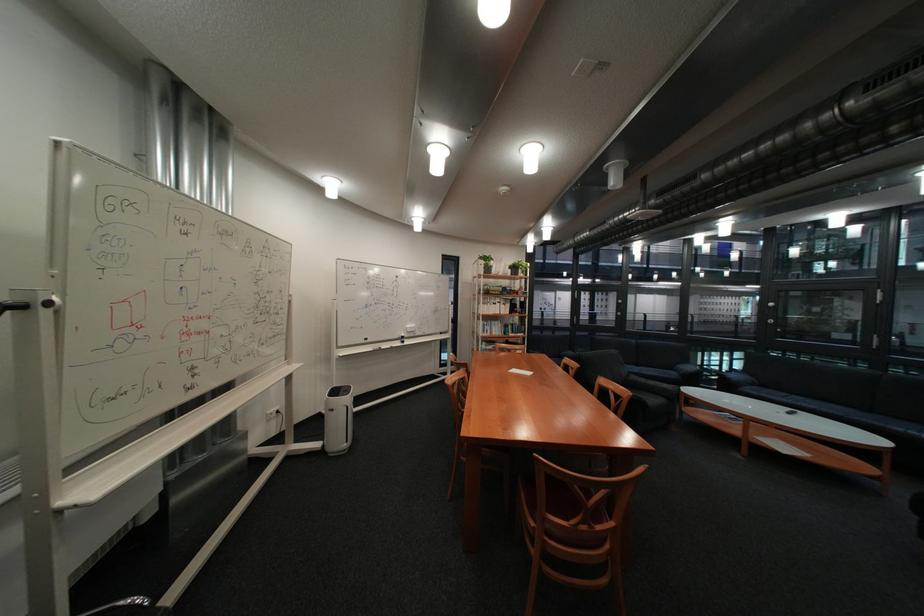
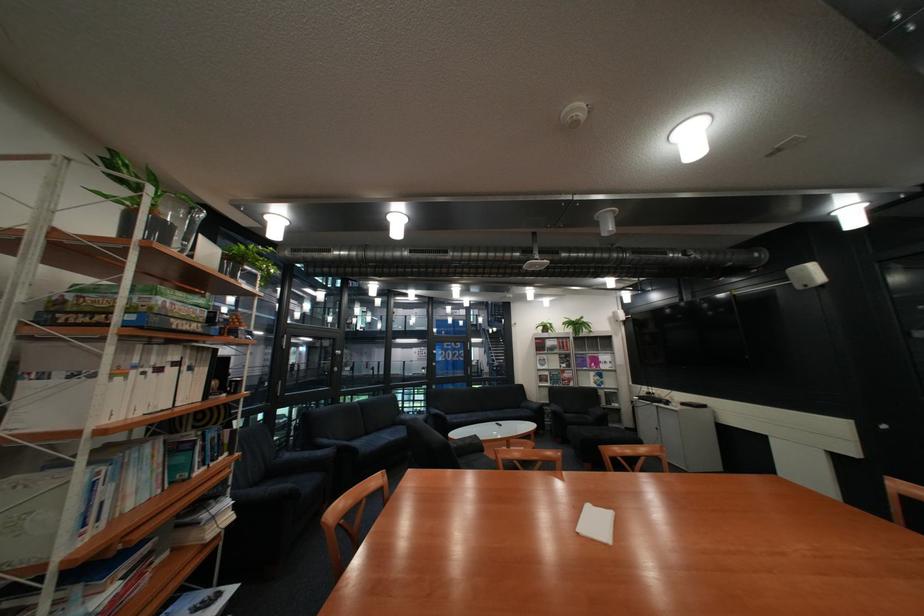
Locate, in the second image, the point that corresponds to point (502, 305) in the first image.

(134, 379)